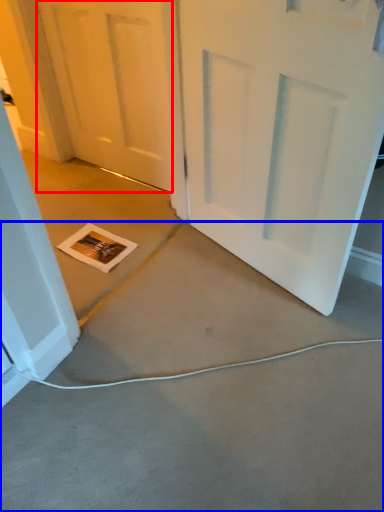
Question: Among these objects, which one is farthest to the camera, door (highlighted by a red box) or concrete (highlighted by a blue box)?

Choices:
 (A) door
 (B) concrete

Answer: (A)